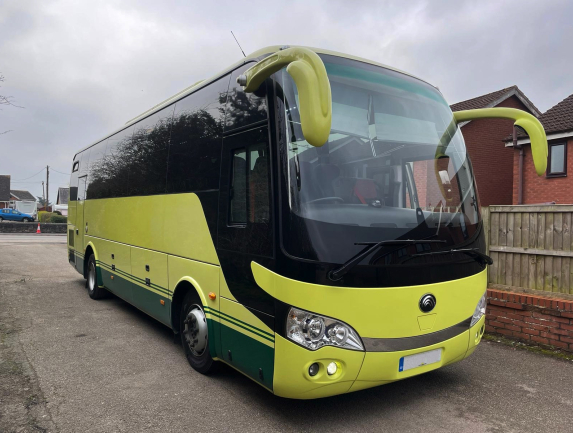
I want to click on brick wall, so click(547, 310).